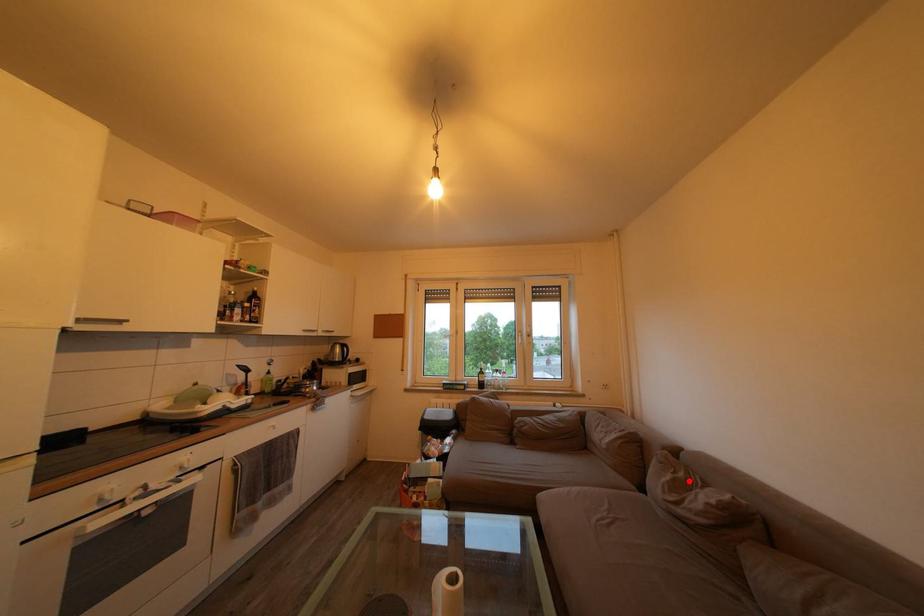
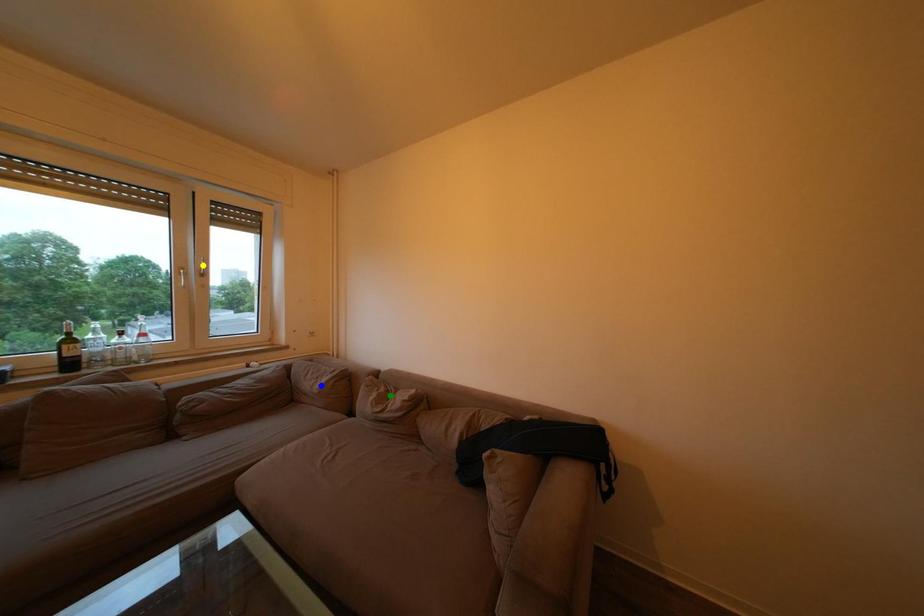
Question: I am providing you with two images of the same scene from different viewpoints. A red point is marked on the first image. You are given multiple points on the second image. Which point in image 2 is actually the same real-world point as the red point in image 1?

Choices:
 (A) green point
 (B) blue point
 (C) yellow point

Answer: (A)